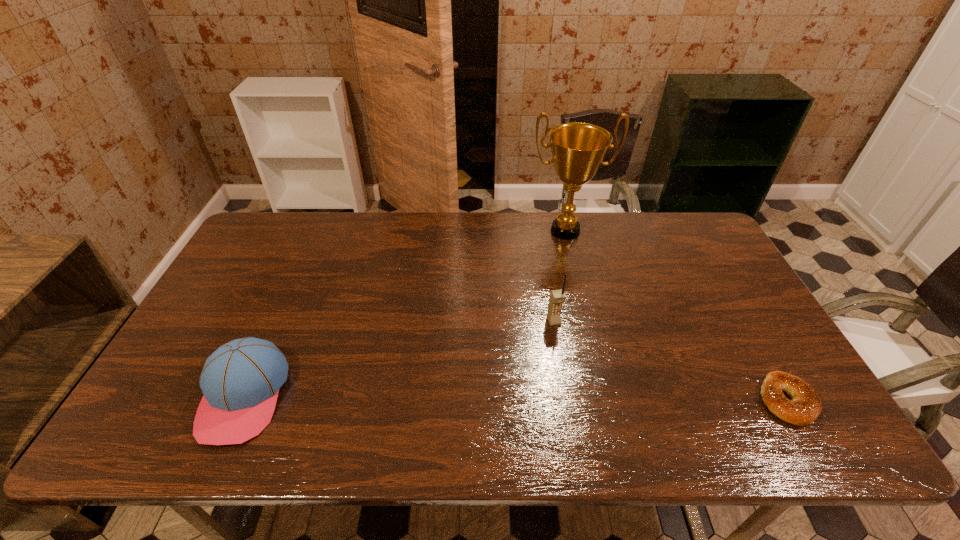
You are a GUI agent. You are given a task and a screenshot of the screen. Output one action in this format:
    pyautogui.click(x=<x>, y=<y>)
    Task: Click on the vacant region that satisfies the following two spatial constraints: 1. on the front-facing side of the shortest object; 2. on the right side of the leftmost object
    Image resolution: width=960 pixels, height=540 pixels.
    Given the screenshot: What is the action you would take?
    pyautogui.click(x=242, y=401)

Find the location of a particular element. The image size is (960, 540). vacant space that satisfies the following two spatial constraints: 1. on the front side of the shortest object; 2. on the left side of the cellular telephone is located at coordinates (566, 401).